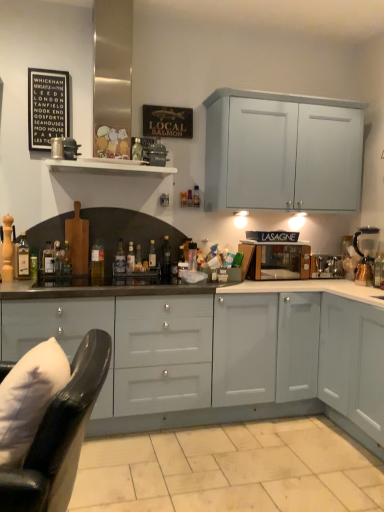
You are a GUI agent. You are given a task and a screenshot of the screen. Output one action in this format:
    pyautogui.click(x=<x>, y=<y>)
    Task: Click on the free point to the right of wooden pepper mill at left, which is the 1th bottle in left-to-right order
    This screenshot has width=384, height=512.
    Given the screenshot: What is the action you would take?
    pyautogui.click(x=29, y=281)